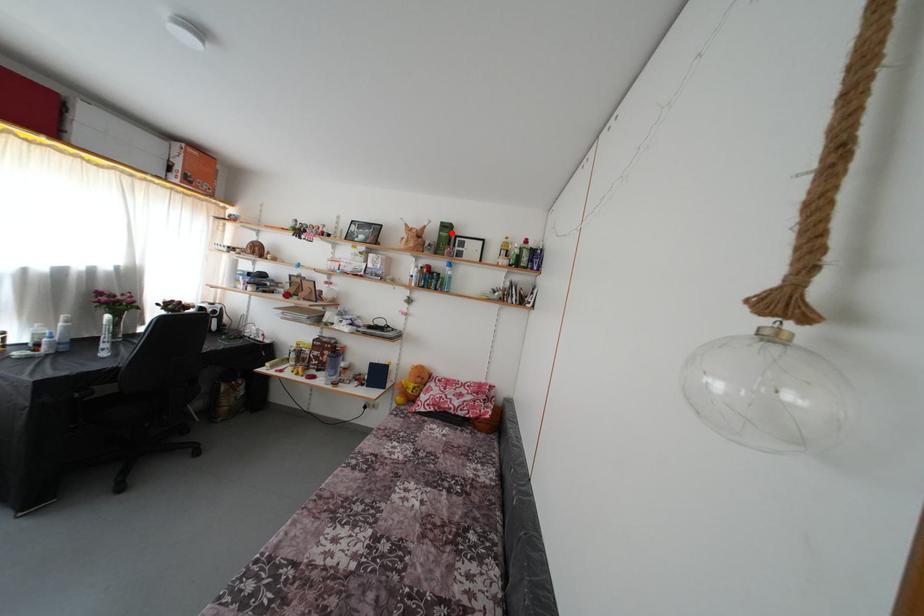
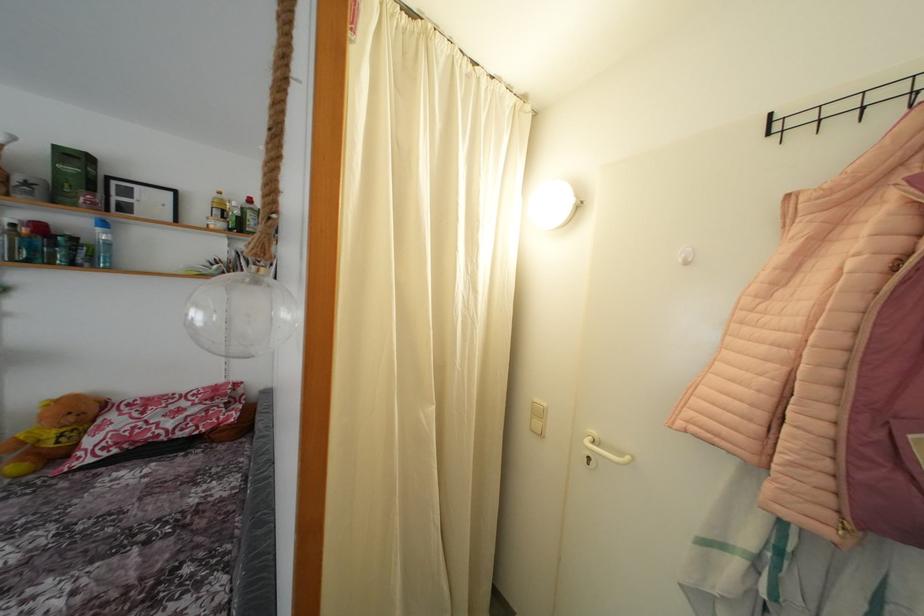
Question: A red point is marked in image1. In image2, is the corresponding 3D point closer to the camera or farther? Reply with the corresponding letter.

Choices:
 (A) The corresponding 3D point is closer.
 (B) The corresponding 3D point is farther.

Answer: (B)